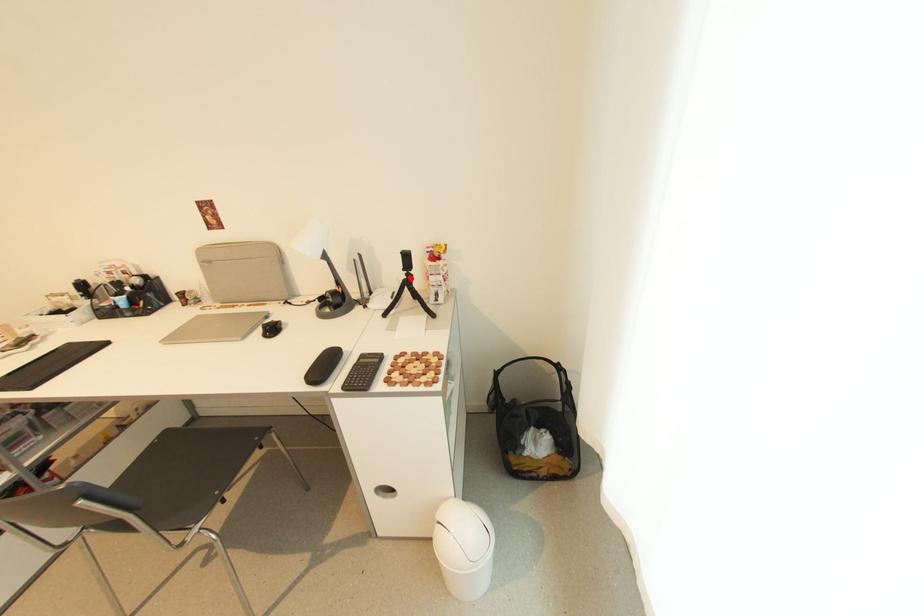
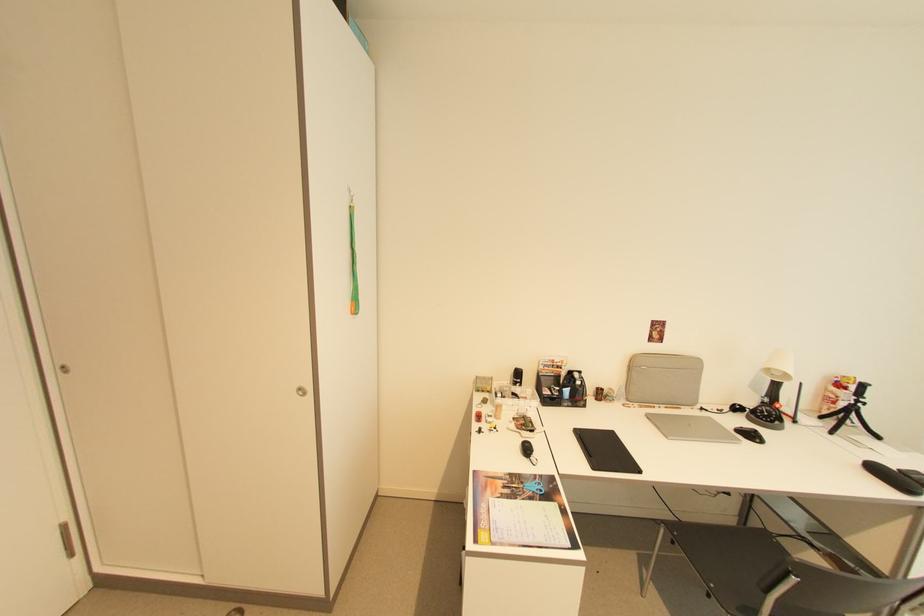
Question: I am providing you with two images of the same scene from different viewpoints. In image1, a red point is highlighted. Considering the same 3D point in image2, which of the following is correct?

Choices:
 (A) It is closer
 (B) It is farther

Answer: (A)